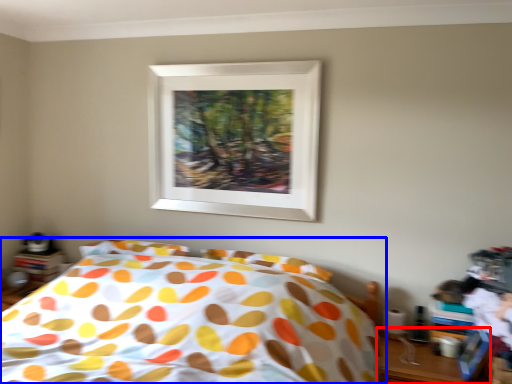
Question: Which of the following is the closest to the observer, table (highlighted by a red box) or bed (highlighted by a blue box)?

Choices:
 (A) table
 (B) bed

Answer: (B)